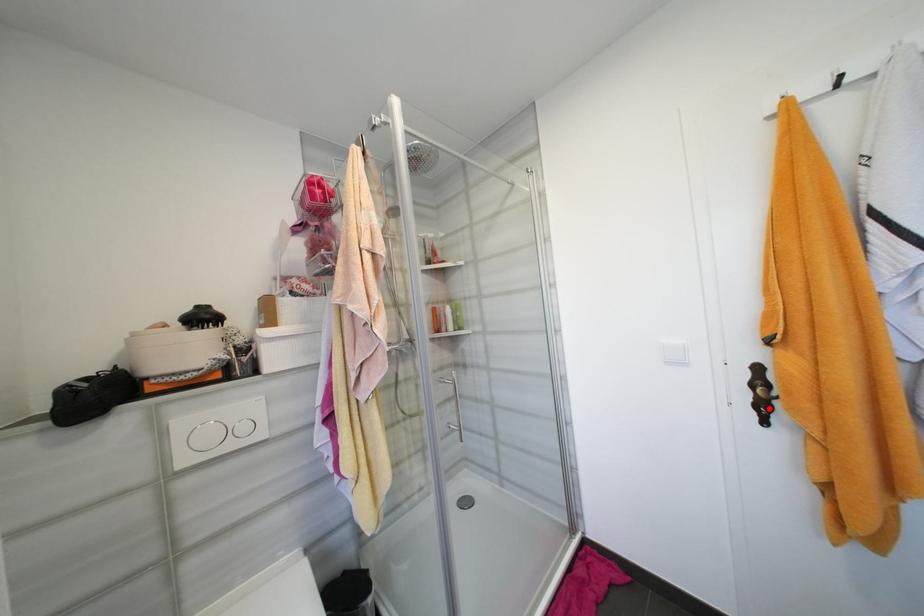
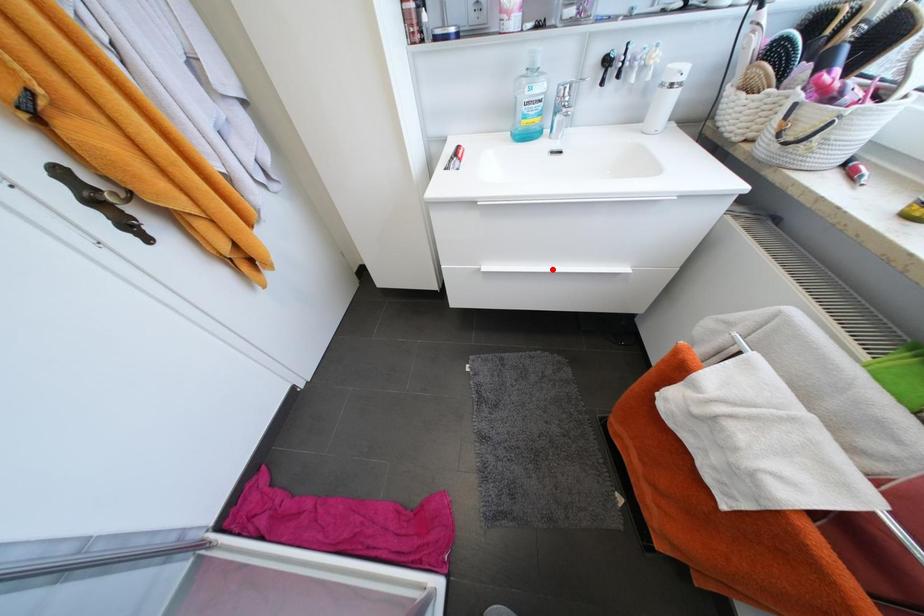
I am providing you with two images of the same scene from different viewpoints. A red point is marked on the first image and another point is marked on the second image. Does the point marked in image1 correspond to the same location as the one in image2?

No